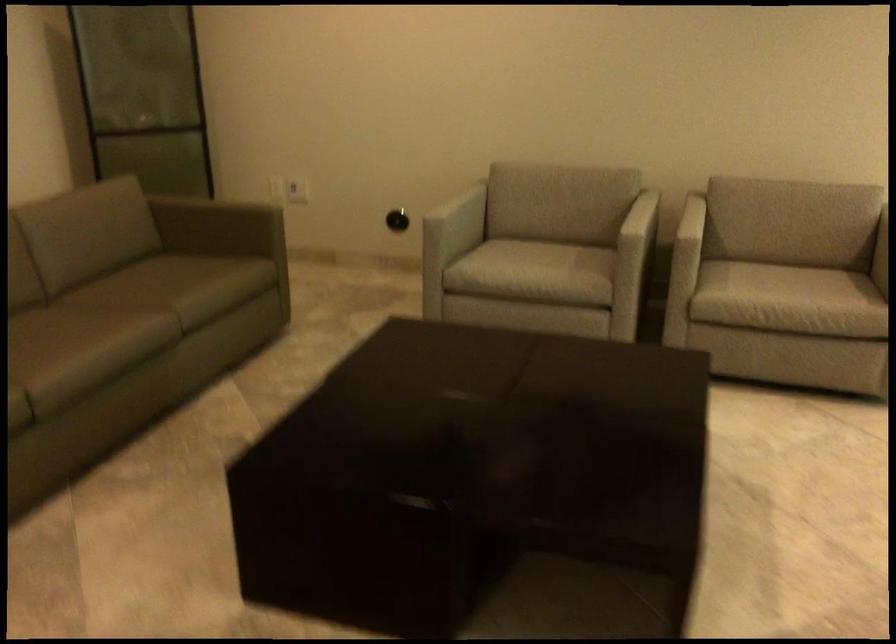
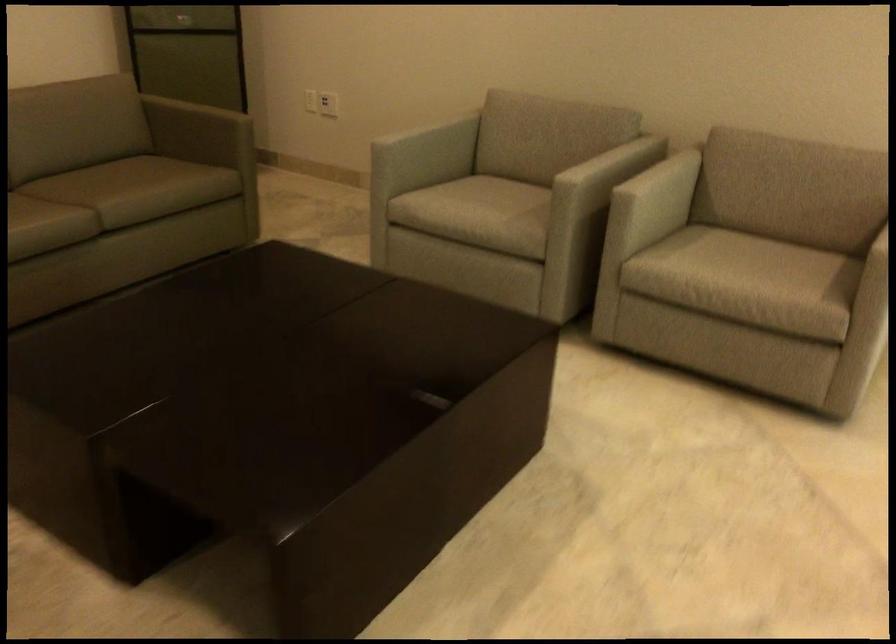
The point at (304, 185) is marked in the first image. Where is the corresponding point in the second image?

(328, 104)